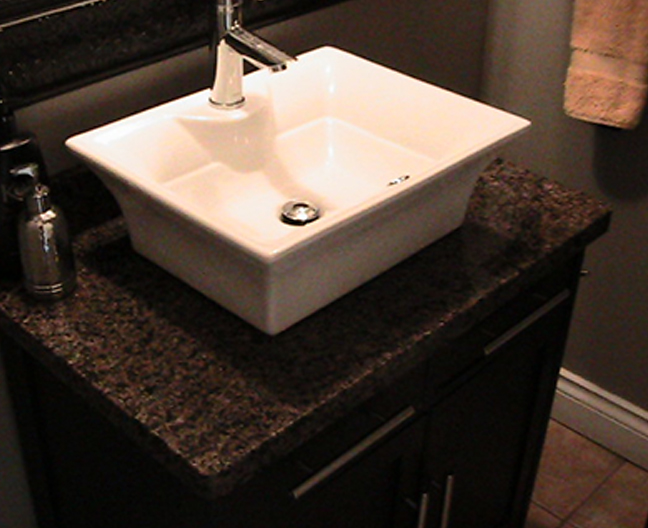
At what (x,y) coordinates should I click in order to perform the action: click on cupboard. Please return your answer as a coordinate pair (x, y). The height and width of the screenshot is (528, 648). Looking at the image, I should click on (507, 471), (399, 520).